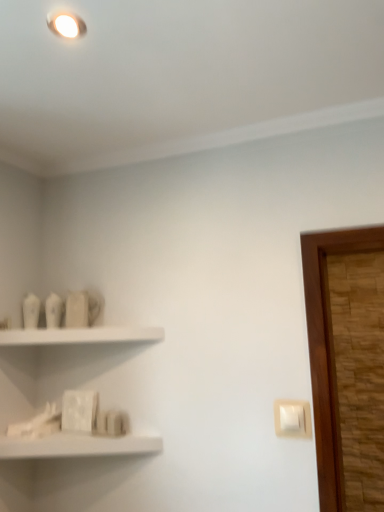
Image resolution: width=384 pixels, height=512 pixels. What do you see at coordinates (80, 335) in the screenshot? I see `white matte shelf at upper left, placed as the second shelf when sorted from bottom to top` at bounding box center [80, 335].

Identify the location of white matte shelf at upper left, the 1th shelf in the top-to-bottom sequence. This screenshot has width=384, height=512. (80, 335).

From a real-world perspective, between white matte shelf at lower left, the first shelf when ordered from bottom to top, and white matte shelf at upper left, the 1th shelf in the top-to-bottom sequence, who is vertically higher?

white matte shelf at upper left, the 1th shelf in the top-to-bottom sequence.

Is point (0, 445) positioned after point (6, 341)?

That is False.

From the image's perspective, is white matte shelf at lower left, the first shelf when ordered from bottom to top, under white matte shelf at upper left, placed as the second shelf when sorted from bottom to top?

Correct, white matte shelf at lower left, the first shelf when ordered from bottom to top, appears lower than white matte shelf at upper left, placed as the second shelf when sorted from bottom to top, in the image.

Identify the location of shelf located on the right of white matte shelf at lower left, which is the 2th shelf from top to bottom. This screenshot has width=384, height=512. (80, 335).

Looking at their sizes, would you say white plastic light switch at lower right is wider or thinner than white matte shelf at upper left, placed as the second shelf when sorted from bottom to top?

In the image, white plastic light switch at lower right appears to be more narrow than white matte shelf at upper left, placed as the second shelf when sorted from bottom to top.

Considering their positions, is white plastic light switch at lower right located in front of or behind white matte shelf at upper left, the 1th shelf in the top-to-bottom sequence?

Visually, white plastic light switch at lower right is located in front of white matte shelf at upper left, the 1th shelf in the top-to-bottom sequence.

Does white plastic light switch at lower right have a smaller size compared to white matte shelf at upper left, the 1th shelf in the top-to-bottom sequence?

Indeed, white plastic light switch at lower right has a smaller size compared to white matte shelf at upper left, the 1th shelf in the top-to-bottom sequence.

From the image's perspective, is white plastic light switch at lower right on top of white matte shelf at upper left, the 1th shelf in the top-to-bottom sequence?

No.

Considering the positions of objects white plastic light switch at lower right and white matte shelf at lower left, the first shelf when ordered from bottom to top, in the image provided, who is more to the right, white plastic light switch at lower right or white matte shelf at lower left, the first shelf when ordered from bottom to top,?

white plastic light switch at lower right is more to the right.

Considering the relative sizes of white plastic light switch at lower right and white matte shelf at lower left, the first shelf when ordered from bottom to top, in the image provided, is white plastic light switch at lower right shorter than white matte shelf at lower left, the first shelf when ordered from bottom to top,?

No.

Can you see white plastic light switch at lower right touching white matte shelf at lower left, the first shelf when ordered from bottom to top?

No, white plastic light switch at lower right is not next to white matte shelf at lower left, the first shelf when ordered from bottom to top.

From the image's perspective, would you say white plastic light switch at lower right is shown under white matte shelf at lower left, which is the 2th shelf from top to bottom?

No.

Is white plastic light switch at lower right surrounded by white matte shelf at lower left, the first shelf when ordered from bottom to top?

No, white matte shelf at lower left, the first shelf when ordered from bottom to top, does not contain white plastic light switch at lower right.

How many degrees apart are the facing directions of white matte shelf at lower left, which is the 2th shelf from top to bottom, and white plastic light switch at lower right?

The angular difference between white matte shelf at lower left, which is the 2th shelf from top to bottom, and white plastic light switch at lower right is 1.66 degrees.

Which is in front, white matte shelf at lower left, which is the 2th shelf from top to bottom, or white plastic light switch at lower right?

white matte shelf at lower left, which is the 2th shelf from top to bottom, is in front.

Is white matte shelf at lower left, which is the 2th shelf from top to bottom, to the right of white plastic light switch at lower right from the viewer's perspective?

No.

From the image's perspective, is white matte shelf at upper left, the 1th shelf in the top-to-bottom sequence, located beneath white matte shelf at lower left, the first shelf when ordered from bottom to top?

Incorrect, from the image's perspective, white matte shelf at upper left, the 1th shelf in the top-to-bottom sequence, is higher than white matte shelf at lower left, the first shelf when ordered from bottom to top.

Considering the sizes of objects white matte shelf at upper left, placed as the second shelf when sorted from bottom to top, and white matte shelf at lower left, the first shelf when ordered from bottom to top, in the image provided, who is wider, white matte shelf at upper left, placed as the second shelf when sorted from bottom to top, or white matte shelf at lower left, the first shelf when ordered from bottom to top,?

white matte shelf at lower left, the first shelf when ordered from bottom to top, is wider.

Does point (41, 343) come behind point (92, 450)?

Yes, point (41, 343) is farther from viewer.

Choose the correct answer: Is white matte shelf at upper left, the 1th shelf in the top-to-bottom sequence, inside white matte shelf at lower left, the first shelf when ordered from bottom to top, or outside it?

white matte shelf at upper left, the 1th shelf in the top-to-bottom sequence, is not enclosed by white matte shelf at lower left, the first shelf when ordered from bottom to top.

From the picture: Which of these two, white matte shelf at upper left, placed as the second shelf when sorted from bottom to top, or white plastic light switch at lower right, stands shorter?

white matte shelf at upper left, placed as the second shelf when sorted from bottom to top, is shorter.

From the image's perspective, which is below, white matte shelf at upper left, the 1th shelf in the top-to-bottom sequence, or white plastic light switch at lower right?

From the image's view, white plastic light switch at lower right is below.

Is the depth of white matte shelf at upper left, the 1th shelf in the top-to-bottom sequence, greater than that of white plastic light switch at lower right?

Yes, it is behind white plastic light switch at lower right.

Which is farther, [152,336] or [300,435]?

The point [152,336] is farther.

Where is `shelf on the right of white matte shelf at lower left, the first shelf when ordered from bottom to top`? This screenshot has height=512, width=384. shelf on the right of white matte shelf at lower left, the first shelf when ordered from bottom to top is located at coordinates (80, 335).

The image size is (384, 512). What are the coordinates of `light switch that is below the white matte shelf at upper left, placed as the second shelf when sorted from bottom to top (from the image's perspective)` in the screenshot? It's located at (292, 419).

Which object lies nearer to the anchor point white matte shelf at lower left, the first shelf when ordered from bottom to top, white plastic light switch at lower right or white matte shelf at upper left, the 1th shelf in the top-to-bottom sequence?

Among the two, white matte shelf at upper left, the 1th shelf in the top-to-bottom sequence, is located nearer to white matte shelf at lower left, the first shelf when ordered from bottom to top.

From the image, which object appears to be nearer to white matte shelf at upper left, the 1th shelf in the top-to-bottom sequence, white plastic light switch at lower right or white matte shelf at lower left, the first shelf when ordered from bottom to top?

Among the two, white matte shelf at lower left, the first shelf when ordered from bottom to top, is located nearer to white matte shelf at upper left, the 1th shelf in the top-to-bottom sequence.

Based on their spatial positions, is white matte shelf at upper left, the 1th shelf in the top-to-bottom sequence, or white plastic light switch at lower right further from white matte shelf at lower left, the first shelf when ordered from bottom to top?

white plastic light switch at lower right is further to white matte shelf at lower left, the first shelf when ordered from bottom to top.

Based on their spatial positions, is white matte shelf at upper left, placed as the second shelf when sorted from bottom to top, or white matte shelf at lower left, which is the 2th shelf from top to bottom, closer to white plastic light switch at lower right?

white matte shelf at lower left, which is the 2th shelf from top to bottom, is positioned closer to the anchor white plastic light switch at lower right.

Considering their positions, is white matte shelf at lower left, which is the 2th shelf from top to bottom, positioned closer to white matte shelf at upper left, placed as the second shelf when sorted from bottom to top, than white plastic light switch at lower right?

Among the two, white matte shelf at lower left, which is the 2th shelf from top to bottom, is located nearer to white matte shelf at upper left, placed as the second shelf when sorted from bottom to top.

When comparing their distances from white plastic light switch at lower right, does white matte shelf at lower left, the first shelf when ordered from bottom to top, or white matte shelf at upper left, placed as the second shelf when sorted from bottom to top, seem closer?

Based on the image, white matte shelf at lower left, the first shelf when ordered from bottom to top, appears to be nearer to white plastic light switch at lower right.

At what (x,y) coordinates should I click in order to perform the action: click on shelf between white matte shelf at lower left, which is the 2th shelf from top to bottom, and white plastic light switch at lower right from left to right. Please return your answer as a coordinate pair (x, y). Looking at the image, I should click on (80, 335).